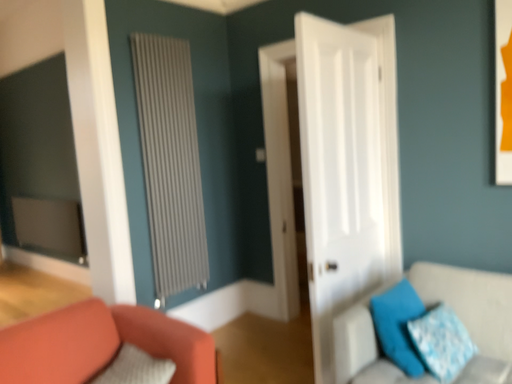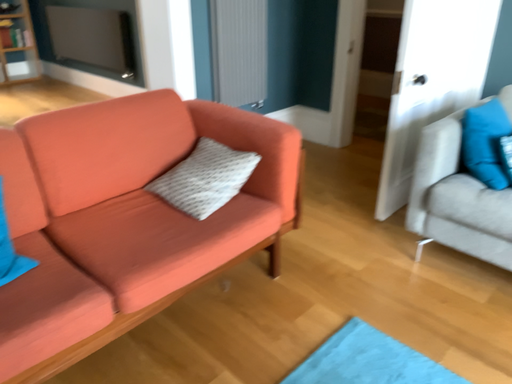
Question: Which way did the camera rotate in the video?

Choices:
 (A) rotated upward
 (B) rotated downward

Answer: (B)